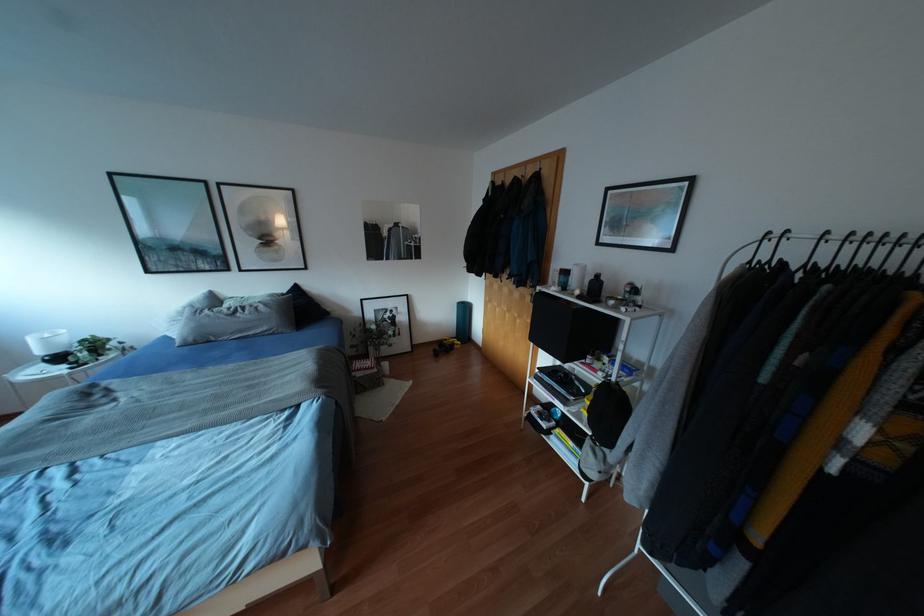
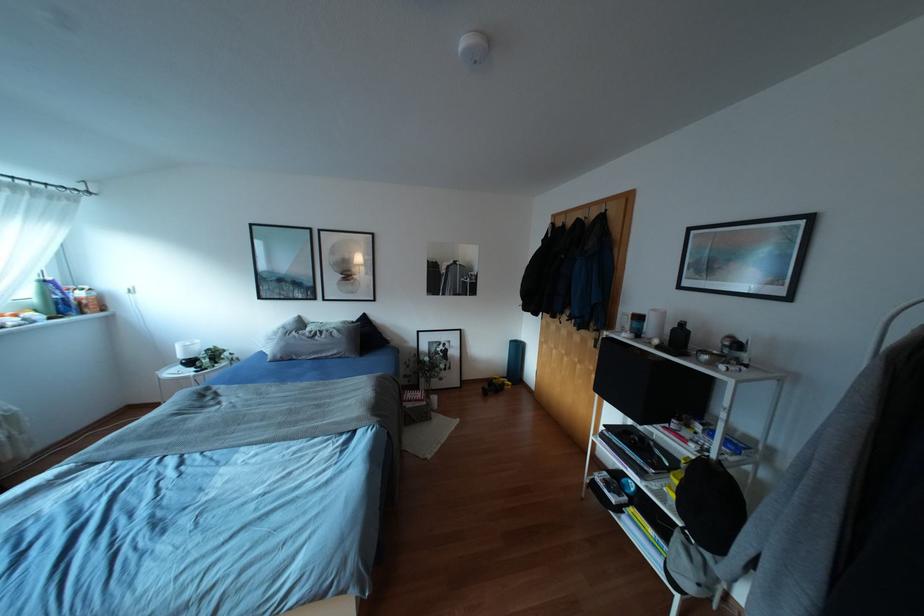
Where in the second image is the point corresponding to pixel 616 382 from the first image?

(719, 461)